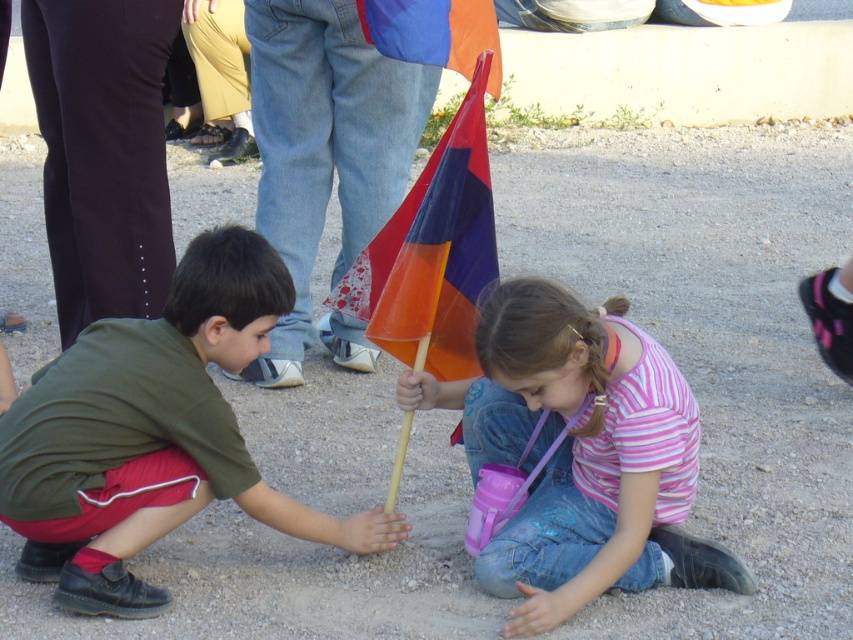
Who is more forward, (70,474) or (480,1)?

Positioned in front is point (70,474).

Between point (114, 429) and point (474, 60), which one is positioned behind?

The point (474, 60) is more distant.

At what (x,y) coordinates should I click in order to perform the action: click on green matte shirt at lower left. Please return your answer as a coordinate pair (x, y). Looking at the image, I should click on (152, 435).

What are the coordinates of `green matte shirt at lower left` in the screenshot? It's located at point(152,435).

Does translucent plastic flag at center appear on the right side of orange fabric flag at upper center?

No, translucent plastic flag at center is not to the right of orange fabric flag at upper center.

Describe the element at coordinates (432, 253) in the screenshot. I see `translucent plastic flag at center` at that location.

The width and height of the screenshot is (853, 640). I want to click on translucent plastic flag at center, so click(432, 253).

Is the position of green matte shirt at lower left more distant than that of pink striped shirt at center?

Yes.

Can you confirm if green matte shirt at lower left is taller than pink striped shirt at center?

Indeed, green matte shirt at lower left has a greater height compared to pink striped shirt at center.

The width and height of the screenshot is (853, 640). What do you see at coordinates (152, 435) in the screenshot? I see `green matte shirt at lower left` at bounding box center [152, 435].

This screenshot has height=640, width=853. What are the coordinates of `green matte shirt at lower left` in the screenshot? It's located at (152, 435).